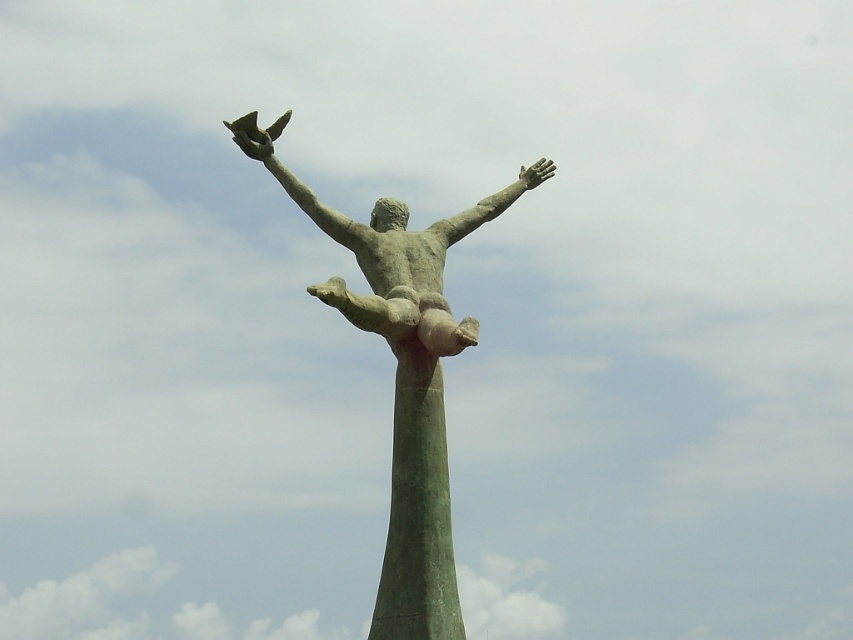
You are an art student analyzing a statue. You notice two statues in the image, the green patina statue at center and the bronze statue at center. Which one is positioned more to the left side of the image?

The green patina statue at center is positioned more to the left side of the image compared to the bronze statue at center.

You are standing in front of the statue and want to take a photo. You notice two points on the statue labeled as point (474, 205) and point (405, 554). Which point is closer to your camera lens?

Point (474, 205) is further to the camera than point (405, 554), so the point closer to your camera lens is point (405, 554).

You are an artist planning to paint the statue. You need to know which part is narrower between the green patina pole at center and the green patina statue arm at upper center. Which one should you focus on first if you want to start with the narrower part?

The green patina pole at center is narrower than the green patina statue arm at upper center, so you should focus on the green patina pole at center first.